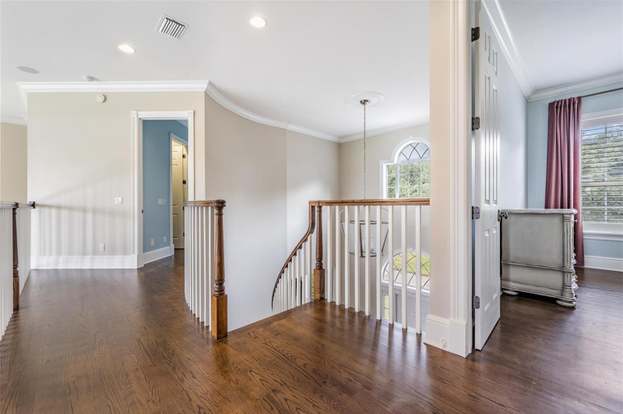
You are a GUI agent. You are given a task and a screenshot of the screen. Output one action in this format:
    pyautogui.click(x=<x>, y=<y>)
    Task: Click on the windows
    This screenshot has height=414, width=623.
    Given the screenshot: What is the action you would take?
    pyautogui.click(x=607, y=140), pyautogui.click(x=400, y=172)